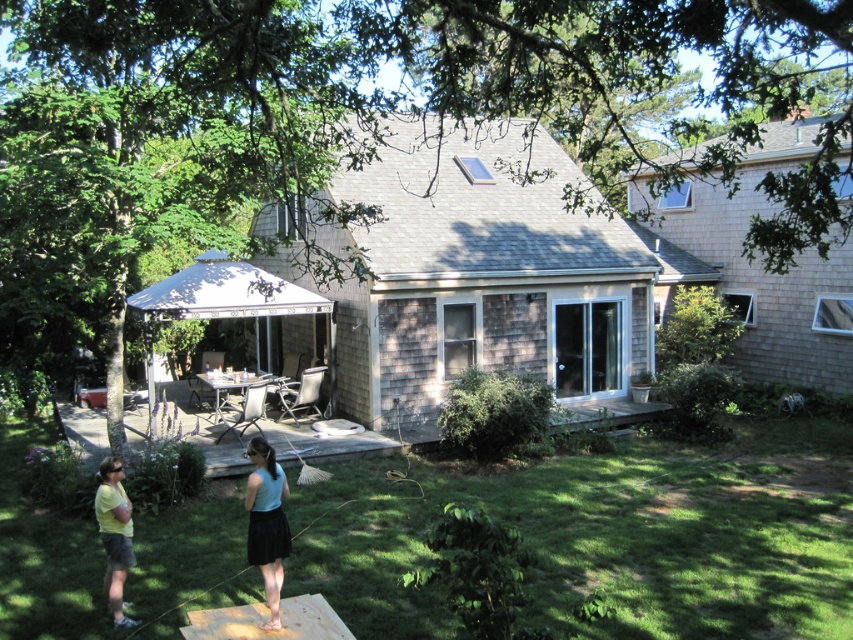
Question: Based on their relative distances, which object is nearer to the wooden deck at center?

Choices:
 (A) yellow t-shirt at lower left
 (B) green grass at lower center

Answer: (B)

Question: Can you confirm if green grass at lower center is positioned to the left of yellow t-shirt at lower left?

Choices:
 (A) no
 (B) yes

Answer: (A)

Question: Is green grass at lower center to the left of yellow t-shirt at lower left from the viewer's perspective?

Choices:
 (A) no
 (B) yes

Answer: (A)

Question: Estimate the real-world distances between objects in this image. Which object is closer to the wooden deck at center?

Choices:
 (A) green grass at lower center
 (B) yellow t-shirt at lower left
 (C) light blue fabric skirt at lower center

Answer: (A)

Question: Which of the following is the farthest from the observer?

Choices:
 (A) light blue fabric skirt at lower center
 (B) yellow t-shirt at lower left
 (C) wooden deck at center

Answer: (C)

Question: Does light blue fabric skirt at lower center come in front of yellow t-shirt at lower left?

Choices:
 (A) no
 (B) yes

Answer: (B)